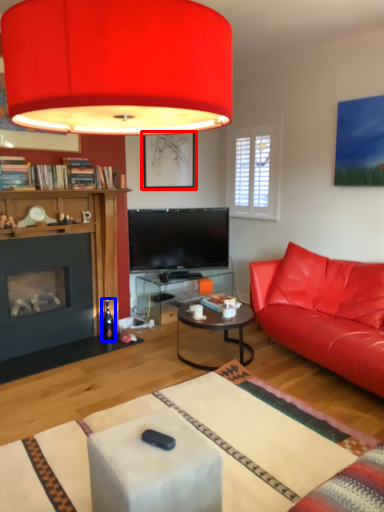
Question: Which object appears closest to the camera in this image, picture frame (highlighted by a red box) or wine bottle (highlighted by a blue box)?

Choices:
 (A) picture frame
 (B) wine bottle

Answer: (B)